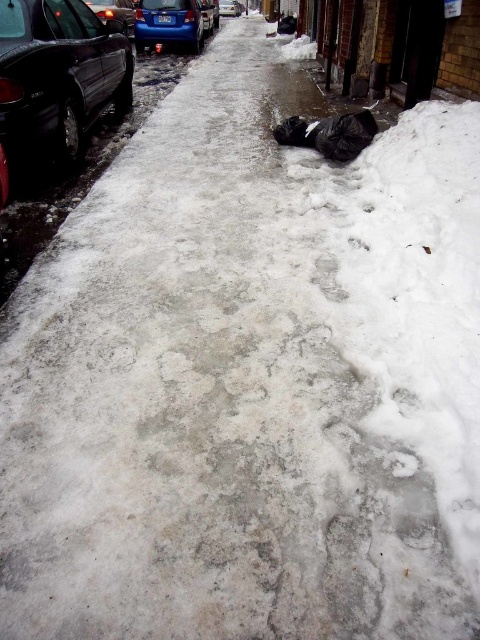
Between shiny black sedan at left and blue metallic car at center, which one has less height?

With less height is shiny black sedan at left.

Between shiny black sedan at left and blue metallic car at center, which one appears on the right side from the viewer's perspective?

blue metallic car at center

What do you see at coordinates (59, 74) in the screenshot?
I see `shiny black sedan at left` at bounding box center [59, 74].

Locate an element on the screen. The image size is (480, 640). shiny black sedan at left is located at coordinates (59, 74).

Which is more to the left, shiny blue sedan at upper left or shiny metallic car at upper left?

shiny metallic car at upper left

Between shiny blue sedan at upper left and shiny metallic car at upper left, which one has less height?

shiny metallic car at upper left

Which is in front, point (186, 35) or point (128, 29)?

Point (186, 35)

You are a GUI agent. You are given a task and a screenshot of the screen. Output one action in this format:
    pyautogui.click(x=<x>, y=<y>)
    Task: Click on the shiny blue sedan at upper left
    The height and width of the screenshot is (640, 480).
    Given the screenshot: What is the action you would take?
    pyautogui.click(x=168, y=22)

Between shiny blue sedan at upper left and blue metallic car at center, which one appears on the left side from the viewer's perspective?

shiny blue sedan at upper left is more to the left.

In the scene shown: Can you confirm if shiny blue sedan at upper left is wider than blue metallic car at center?

Correct, the width of shiny blue sedan at upper left exceeds that of blue metallic car at center.

You are a GUI agent. You are given a task and a screenshot of the screen. Output one action in this format:
    pyautogui.click(x=<x>, y=<y>)
    Task: Click on the shiny blue sedan at upper left
    
    Given the screenshot: What is the action you would take?
    pyautogui.click(x=168, y=22)